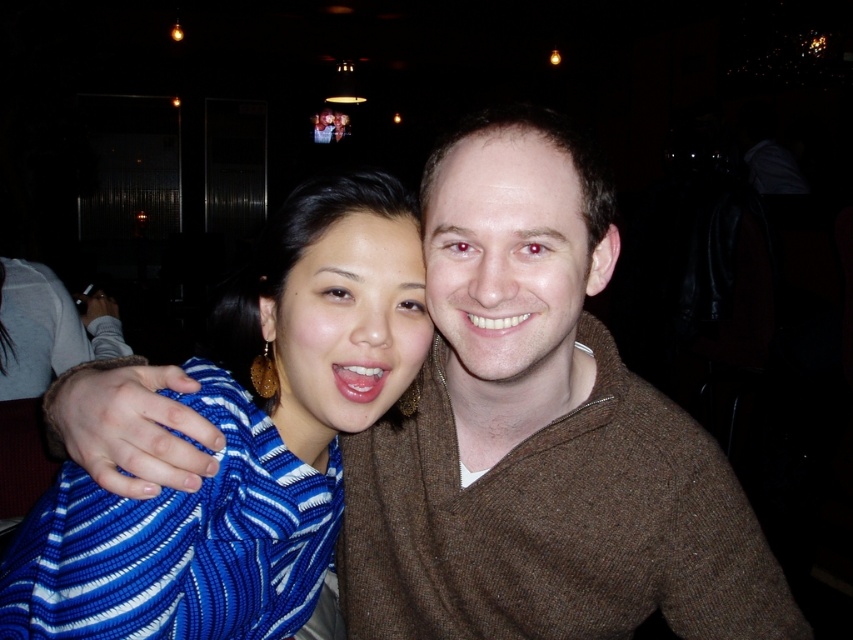
You are a photographer trying to adjust the lighting for a photo of the brown wool sweater at center and the blue knitted sweater at center. Since the background is dimly lit, you want to ensure both sweaters are equally visible. Which sweater should you focus the light on first, the one that is higher or lower in the image?

The brown wool sweater at center is below the blue knitted sweater at center. To ensure both are equally visible, focus the light on the lower brown wool sweater at center first since it is in a darker area and needs more illumination.

You are a photographer trying to adjust the lighting in the image. The brown wool sweater at center is represented by point (540, 433). Where should you focus the light to highlight the brown wool sweater at center?

The brown wool sweater at center is represented by point (540, 433), so you should focus the light on that point to highlight it.

You are at a social event and want to take a photo of the brown wool sweater at center and the blue knitted sweater at center. Which one is on the right side when looking at the photo?

The brown wool sweater at center is positioned on the right side of the blue knitted sweater at center, so it is on the right side in the photo.